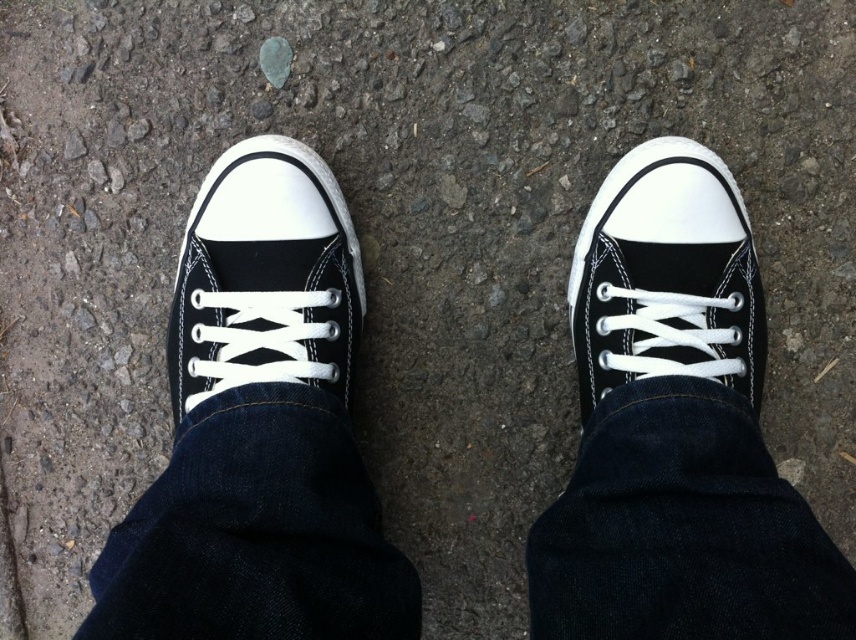
Who is taller, black canvas shoe at left or black canvas shoe at right?

With more height is black canvas shoe at left.

Consider the image. Can you confirm if black canvas shoe at left is positioned below black canvas shoe at right?

Actually, black canvas shoe at left is above black canvas shoe at right.

Locate an element on the screen. black canvas shoe at left is located at coordinates (265, 276).